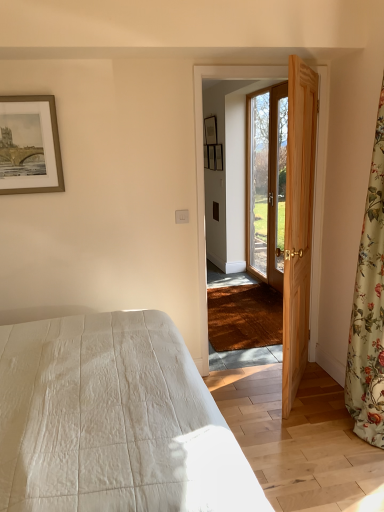
Question: Which is correct: wooden door at right, which appears as the 1th door when viewed from the back, is inside gold-framed artwork at upper left, arranged as the first picture frame when ordered from the bottom, or outside of it?

Choices:
 (A) outside
 (B) inside

Answer: (A)

Question: Relative to gold-framed artwork at upper left, arranged as the 1th picture frame when viewed from the left, is wooden door at right, which is the 2th door in front-to-back order, in front or behind?

Choices:
 (A) behind
 (B) front

Answer: (A)

Question: Based on their relative distances, which object is farther from the natural wood door at right, arranged as the 1th door when viewed from the front?

Choices:
 (A) matte wooden picture frame at upper center, the fourth picture frame when ordered from left to right
 (B) gold-framed artwork at upper left, which ranks as the 4th picture frame in right-to-left order
 (C) white quilted bed at lower left
 (D) wooden door at right, which is the 2th door in front-to-back order
 (E) matte black picture frame at upper center, the first picture frame positioned from the top

Answer: (E)

Question: Estimate the real-world distances between objects in this image. Which object is farther from the floral fabric curtain at right?

Choices:
 (A) matte black picture frame at upper center, acting as the second picture frame starting from the left
 (B) wooden screen door at center
 (C) wooden picture frame at center, which ranks as the 4th picture frame in front-to-back order
 (D) gold-framed artwork at upper left, the 1th picture frame when ordered from front to back
 (E) matte wooden picture frame at upper center, which is the second picture frame from bottom to top

Answer: (A)